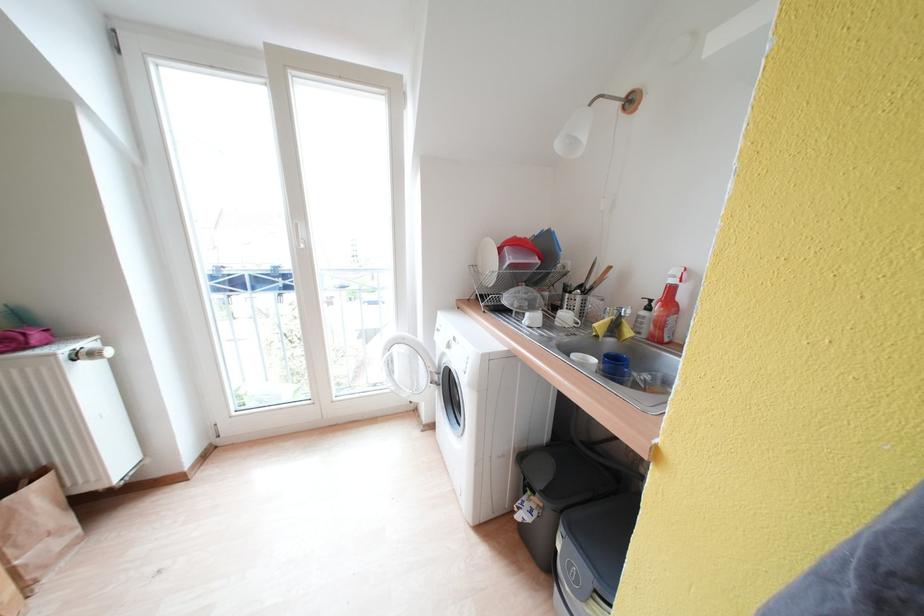
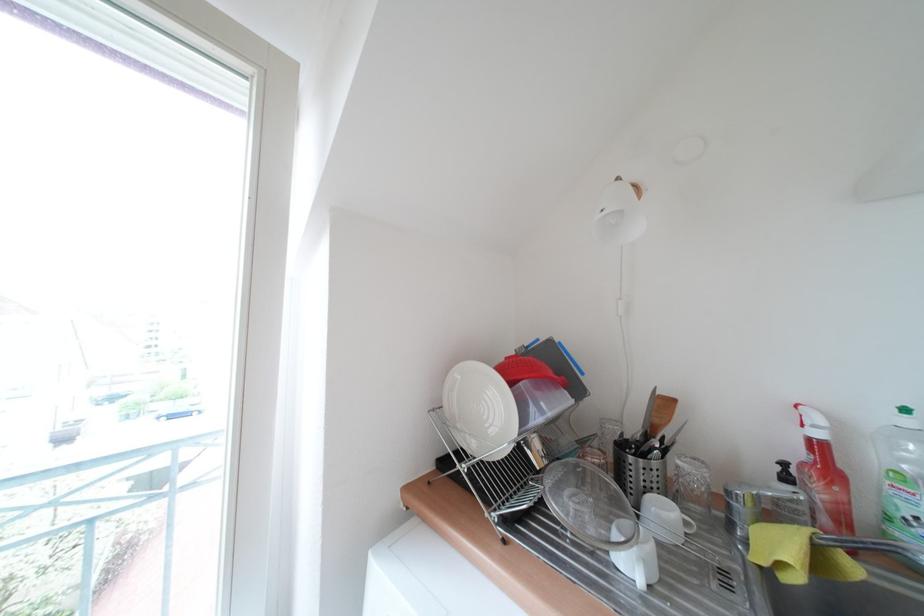
Consider the image. First-person continuous shooting, in which direction is the camera rotating?

The camera's rotation is toward right-up.